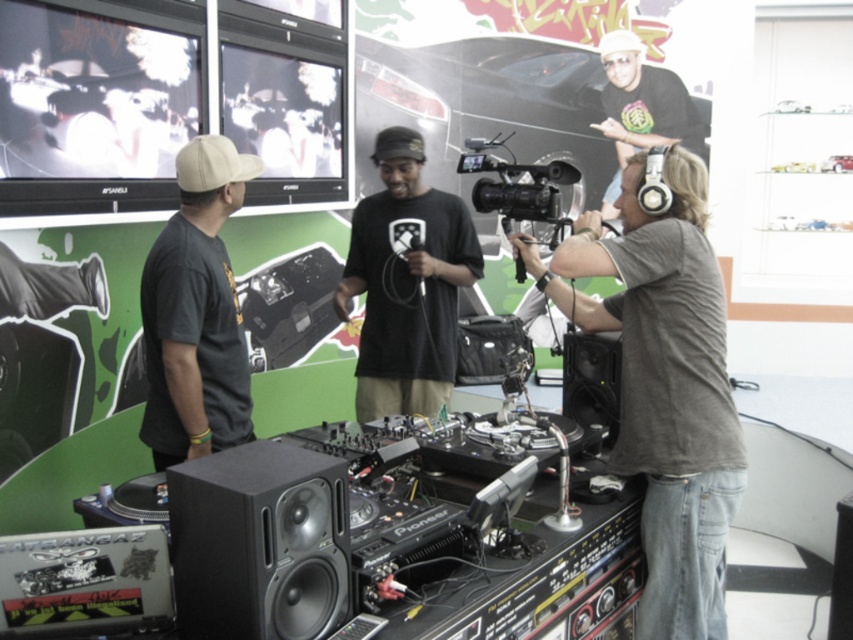
Question: Can you confirm if black matte speaker at lower center is positioned above white matte headphones at upper right?

Choices:
 (A) no
 (B) yes

Answer: (A)

Question: Estimate the real-world distances between objects in this image. Which object is farther from the black matte speaker at lower right?

Choices:
 (A) white matte headphones at upper right
 (B) white matte baseball cap at upper left
 (C) white matte baseball hat at upper center
 (D) gray matte headphones at center

Answer: (C)

Question: Considering the real-world distances, which object is farthest from the black plastic video camera at center?

Choices:
 (A) white matte baseball hat at upper center
 (B) dark gray t-shirt at left
 (C) black matte speaker at lower right
 (D) black matte baseball cap at center

Answer: (A)

Question: Does white matte headphones at upper right lie in front of white matte baseball cap at upper left?

Choices:
 (A) no
 (B) yes

Answer: (A)

Question: Observing the image, what is the correct spatial positioning of gray matte headphones at center in reference to black matte shirt at center?

Choices:
 (A) left
 (B) right

Answer: (B)

Question: Which point is farther to the camera?

Choices:
 (A) black matte baseball cap at center
 (B) white matte baseball hat at upper center
 (C) black plastic video camera at center
 (D) white matte baseball cap at upper left

Answer: (B)